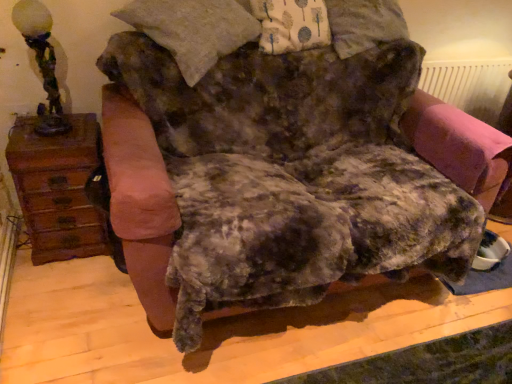
You are a GUI agent. You are given a task and a screenshot of the screen. Output one action in this format:
    pyautogui.click(x=<x>, y=<y>)
    Task: Click on the pink fabric swivel chair at right
    This screenshot has width=512, height=384.
    Given the screenshot: What is the action you would take?
    pyautogui.click(x=459, y=146)

I want to click on antique bronze lamp at left, so click(42, 62).

Does pink plastic radiator at upper right contain brown wood dresser at left?

Definitely not — brown wood dresser at left is not inside pink plastic radiator at upper right.

Looking at the image, does pink plastic radiator at upper right seem bigger or smaller compared to brown wood dresser at left?

pink plastic radiator at upper right is smaller than brown wood dresser at left.

From a real-world perspective, is pink plastic radiator at upper right beneath brown wood dresser at left?

No, from a real-world perspective, pink plastic radiator at upper right is not beneath brown wood dresser at left.

Considering the sizes of pink plastic radiator at upper right and brown wood dresser at left in the image, is pink plastic radiator at upper right wider or thinner than brown wood dresser at left?

Clearly, pink plastic radiator at upper right has less width compared to brown wood dresser at left.

Looking at this image, is pink plastic radiator at upper right at the right side of pink fabric swivel chair at right?

Correct, you'll find pink plastic radiator at upper right to the right of pink fabric swivel chair at right.

What's the angular difference between pink plastic radiator at upper right and pink fabric swivel chair at right's facing directions?

pink plastic radiator at upper right and pink fabric swivel chair at right are facing 178 degrees away from each other.

Based on the photo, is pink plastic radiator at upper right looking in the opposite direction of pink fabric swivel chair at right?

No, pink plastic radiator at upper right's orientation is not away from pink fabric swivel chair at right.

Does pink fabric swivel chair at right contain brown wood dresser at left?

No, pink fabric swivel chair at right does not contain brown wood dresser at left.

Considering the relative sizes of pink fabric swivel chair at right and brown wood dresser at left in the image provided, is pink fabric swivel chair at right taller than brown wood dresser at left?

Incorrect, the height of pink fabric swivel chair at right is not larger of that of brown wood dresser at left.

Is point (434, 97) closer to viewer compared to point (55, 250)?

No, (434, 97) is further to viewer.

From the image's perspective, is pink fabric swivel chair at right beneath brown wood dresser at left?

No, from the image's perspective, pink fabric swivel chair at right is not beneath brown wood dresser at left.

Can antique bronze lamp at left be found inside pink fabric swivel chair at right?

No.

Is antique bronze lamp at left at the back of pink fabric swivel chair at right?

pink fabric swivel chair at right is not turned away from antique bronze lamp at left.

Does pink fabric swivel chair at right come in front of antique bronze lamp at left?

No, it is not.

The height and width of the screenshot is (384, 512). Identify the location of swivel chair behind the antique bronze lamp at left. (459, 146).

Does point (24, 13) appear closer or farther from the camera than point (500, 194)?

Point (24, 13) is closer to the camera than point (500, 194).

Locate an element on the screen. The height and width of the screenshot is (384, 512). table lamp that is on the left side of pink fabric swivel chair at right is located at coordinates (42, 62).

Could you tell me if antique bronze lamp at left is turned towards pink fabric swivel chair at right?

No, antique bronze lamp at left is not facing towards pink fabric swivel chair at right.

Is antique bronze lamp at left situated inside pink fabric swivel chair at right or outside?

antique bronze lamp at left exists outside the volume of pink fabric swivel chair at right.

Which is more to the right, brown wood dresser at left or pink plastic radiator at upper right?

pink plastic radiator at upper right.

Does brown wood dresser at left touch pink plastic radiator at upper right?

No.

Is brown wood dresser at left surrounding pink plastic radiator at upper right?

Definitely not — pink plastic radiator at upper right is not inside brown wood dresser at left.

Does brown wood dresser at left have a smaller size compared to pink plastic radiator at upper right?

No, brown wood dresser at left is not smaller than pink plastic radiator at upper right.

Identify the location of table lamp above the pink plastic radiator at upper right (from a real-world perspective). (42, 62).

Is pink plastic radiator at upper right at the back of antique bronze lamp at left?

That's not correct — antique bronze lamp at left is not looking away from pink plastic radiator at upper right.

In the image, is antique bronze lamp at left positioned in front of or behind pink plastic radiator at upper right?

Visually, antique bronze lamp at left is located in front of pink plastic radiator at upper right.

At what (x,y) coordinates should I click in order to perform the action: click on radiator above the brown wood dresser at left (from a real-world perspective). Please return your answer as a coordinate pair (x, y). The image size is (512, 384). Looking at the image, I should click on (473, 88).

The width and height of the screenshot is (512, 384). Identify the location of radiator on the right of pink fabric swivel chair at right. (473, 88).

Looking at this image, based on their spatial positions, is pink fabric swivel chair at right or pink plastic radiator at upper right closer to brown wood dresser at left?

pink fabric swivel chair at right lies closer to brown wood dresser at left than the other object.

From the image, which object appears to be nearer to brown wood dresser at left, pink plastic radiator at upper right or pink fabric swivel chair at right?

The object closer to brown wood dresser at left is pink fabric swivel chair at right.

Estimate the real-world distances between objects in this image. Which object is closer to brown wood dresser at left, pink fabric swivel chair at right or antique bronze lamp at left?

antique bronze lamp at left is closer to brown wood dresser at left.

Consider the image. Looking at the image, which one is located closer to antique bronze lamp at left, pink fabric swivel chair at right or brown wood dresser at left?

brown wood dresser at left is positioned closer to the anchor antique bronze lamp at left.

When comparing their distances from antique bronze lamp at left, does pink fabric swivel chair at right or pink plastic radiator at upper right seem closer?

Based on the image, pink fabric swivel chair at right appears to be nearer to antique bronze lamp at left.

When comparing their distances from brown wood dresser at left, does antique bronze lamp at left or pink fabric swivel chair at right seem closer?

antique bronze lamp at left.

Looking at the image, which one is located further to pink fabric swivel chair at right, antique bronze lamp at left or brown wood dresser at left?

antique bronze lamp at left is further to pink fabric swivel chair at right.

Which object lies further to the anchor point antique bronze lamp at left, brown wood dresser at left or pink plastic radiator at upper right?

Based on the image, pink plastic radiator at upper right appears to be further to antique bronze lamp at left.

Identify the location of swivel chair situated between brown wood dresser at left and pink plastic radiator at upper right from left to right. This screenshot has width=512, height=384. (459, 146).

You are a GUI agent. You are given a task and a screenshot of the screen. Output one action in this format:
    pyautogui.click(x=<x>, y=<y>)
    Task: Click on the swivel chair situated between antique bronze lamp at left and pink plastic radiator at upper right from left to right
    
    Given the screenshot: What is the action you would take?
    pyautogui.click(x=459, y=146)

The height and width of the screenshot is (384, 512). I want to click on table lamp between brown wood dresser at left and pink fabric swivel chair at right from left to right, so click(42, 62).

This screenshot has height=384, width=512. I want to click on table lamp located between brown wood dresser at left and pink plastic radiator at upper right in the left-right direction, so click(x=42, y=62).